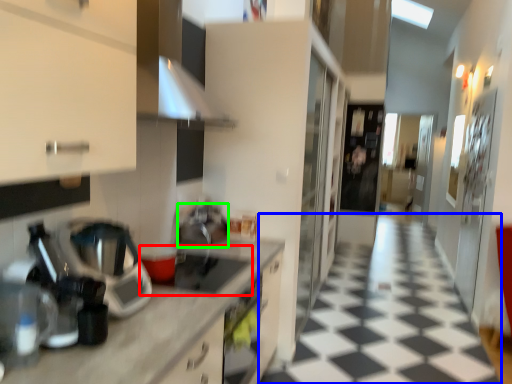
Question: Which object is the closest to the gas stove (highlighted by a red box)? Choose among these: tile (highlighted by a blue box) or appliance (highlighted by a green box).

Choices:
 (A) tile
 (B) appliance

Answer: (B)